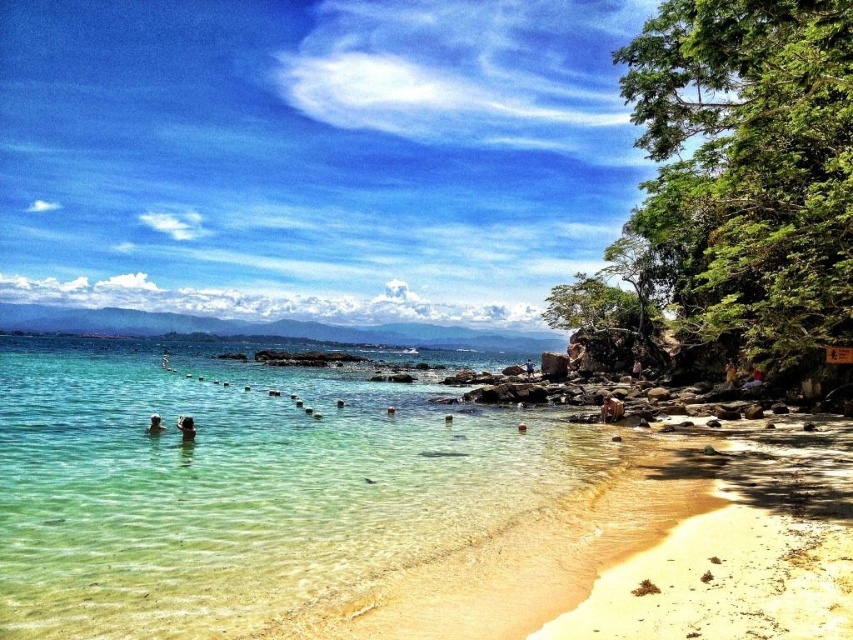
From the picture: You are a photographer trying to capture a photo of both the brown furry dog at lower right and the light brown skin at lower left. Since you want them both in the frame, which object should you zoom out to include more of?

You should zoom out to include more of the brown furry dog at lower right because it is larger in width than the light brown skin at lower left.

You are standing on the beach and see a brown furry dog at lower right and a light brown skin at lower left. Which object is closer to your right side?

Result: The brown furry dog at lower right is closer to your right side because it is positioned to the right of the light brown skin at lower left.